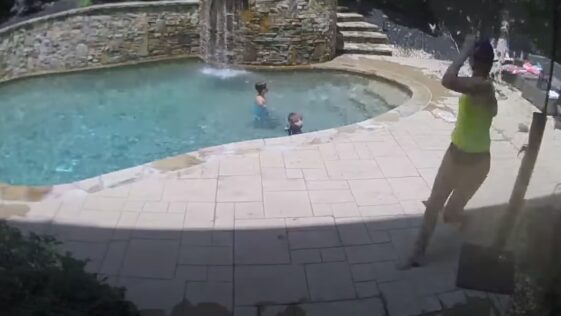
Find the location of a particular element. stairs is located at coordinates (370, 109), (353, 33).